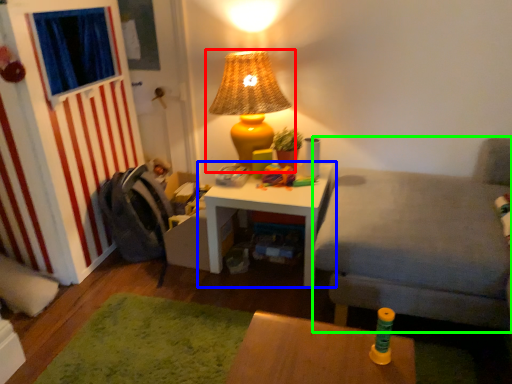
Question: Based on their relative distances, which object is farther from lamp (highlighted by a red box)? Choose from table (highlighted by a blue box) and couch (highlighted by a green box).

Choices:
 (A) table
 (B) couch

Answer: (B)